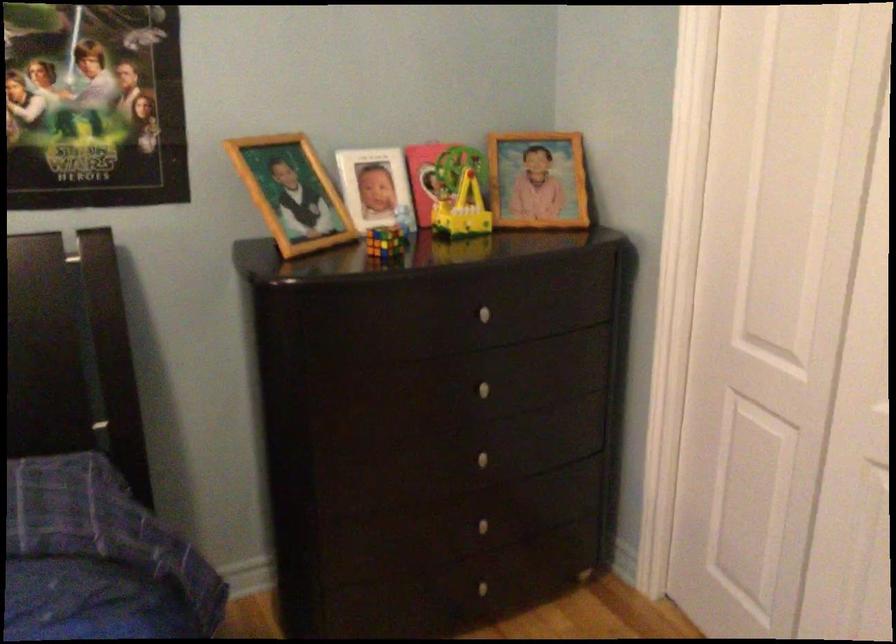
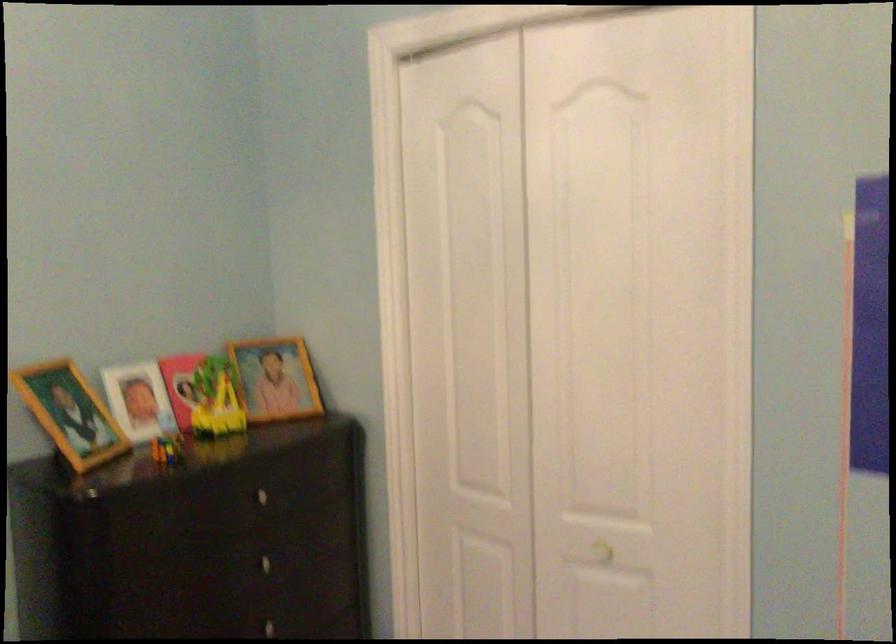
The images are taken continuously from a first-person perspective. In which direction are you moving?

The cameraman moved toward left, backward.